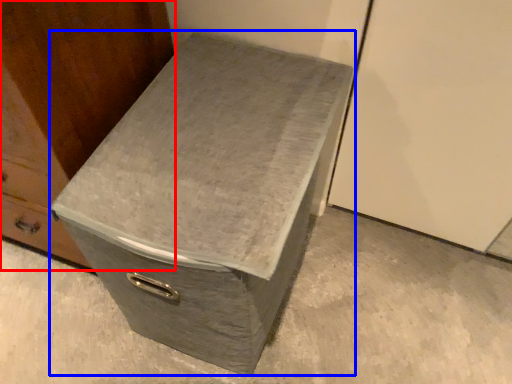
Question: Which point is closer to the camera, furniture (highlighted by a red box) or shoe box (highlighted by a blue box)?

Choices:
 (A) furniture
 (B) shoe box

Answer: (A)